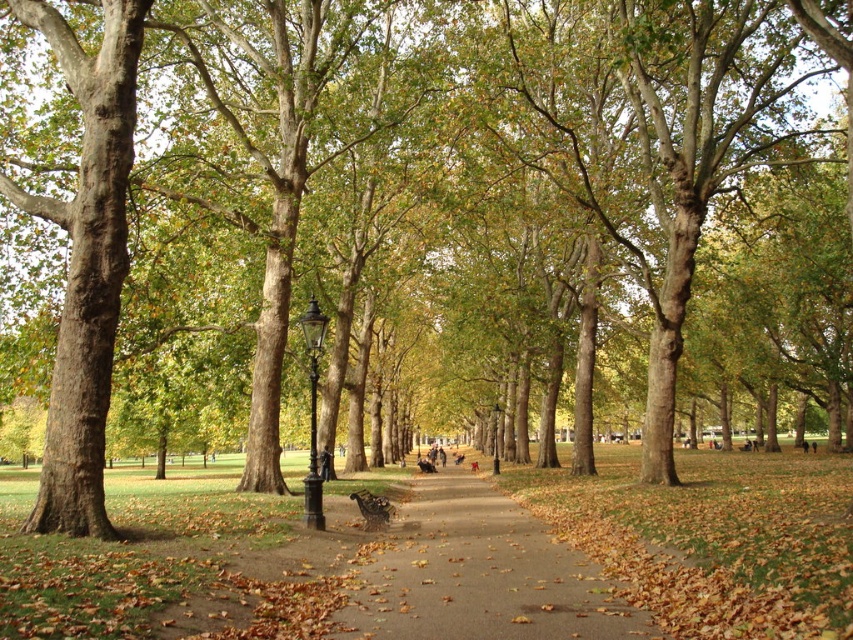
You are standing at the point closer to the camera in the park scene. There are two points marked on the path ahead of you. One is at coordinates point (471,634) and the other is at point (370,499). Which of these points is farther away from your current position?

Point (370,499) is farther away from your current position because it is described as being further from the camera compared to point (471,634).

You are standing at the starting point of the park pathway. You see a point marked at coordinates (479, 573). What object is located at that point?

The point at coordinates (479, 573) marks the location of the brown rough pavement at center.